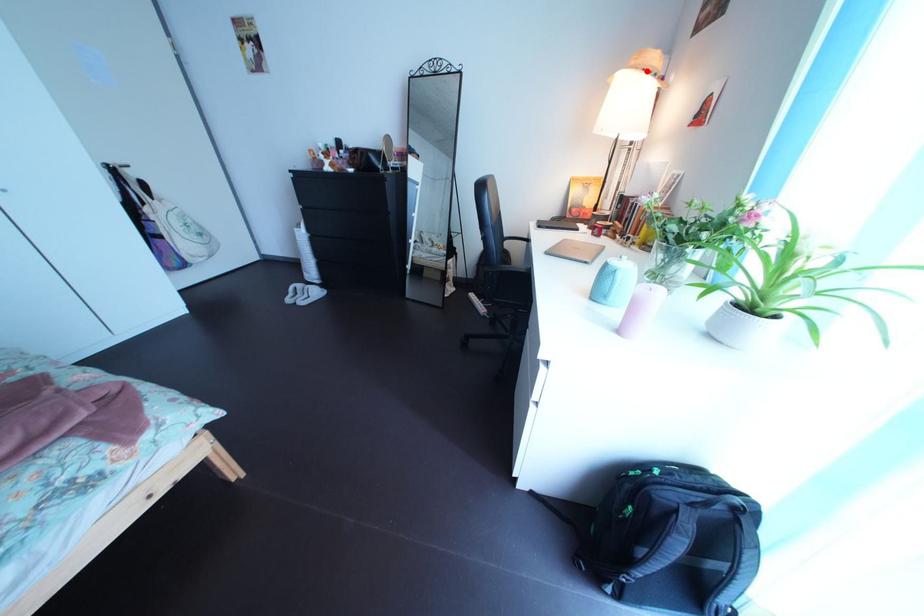
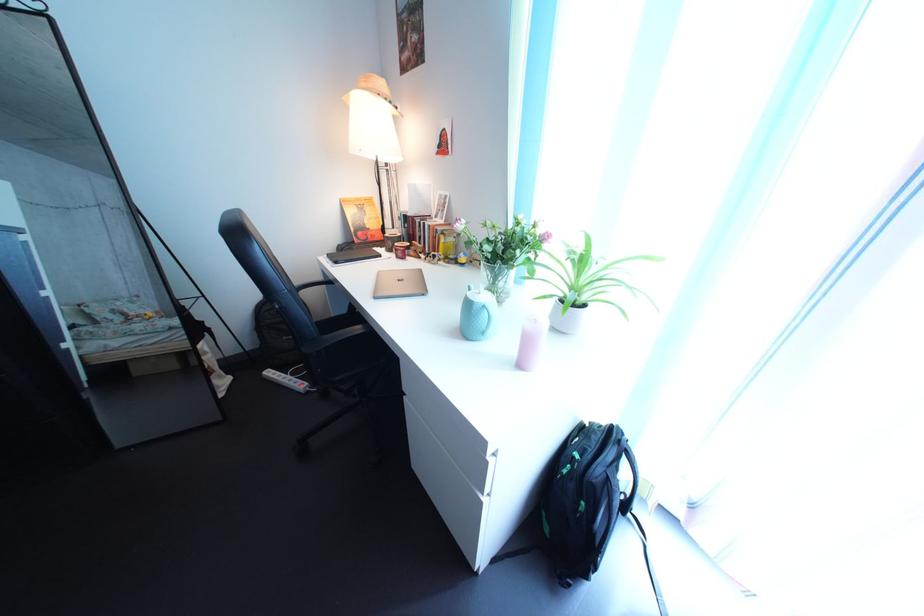
Where in the second image is the point corresponding to the highlighted location from the first image?

(378, 92)